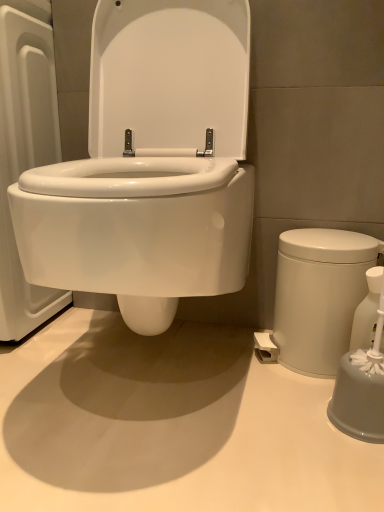
Question: Does white glossy soap dispenser at right have a greater height compared to white glossy trash can at right?

Choices:
 (A) no
 (B) yes

Answer: (A)

Question: Can you confirm if white glossy soap dispenser at right is wider than white glossy trash can at right?

Choices:
 (A) yes
 (B) no

Answer: (B)

Question: Is white glossy soap dispenser at right bigger than white glossy trash can at right?

Choices:
 (A) yes
 (B) no

Answer: (B)

Question: Can you confirm if white glossy soap dispenser at right is shorter than white glossy trash can at right?

Choices:
 (A) yes
 (B) no

Answer: (A)

Question: Considering the relative positions of white glossy soap dispenser at right and white glossy trash can at right in the image provided, is white glossy soap dispenser at right to the left of white glossy trash can at right from the viewer's perspective?

Choices:
 (A) no
 (B) yes

Answer: (A)

Question: Is white glossy trash can at right a part of white glossy soap dispenser at right?

Choices:
 (A) no
 (B) yes

Answer: (A)

Question: Is the position of white glossy trash can at right less distant than that of white glossy soap dispenser at right?

Choices:
 (A) no
 (B) yes

Answer: (A)

Question: Does white glossy trash can at right have a larger size compared to white glossy soap dispenser at right?

Choices:
 (A) no
 (B) yes

Answer: (B)

Question: From the image's perspective, is white glossy trash can at right below white glossy soap dispenser at right?

Choices:
 (A) no
 (B) yes

Answer: (A)

Question: Would you consider white glossy trash can at right to be distant from white glossy soap dispenser at right?

Choices:
 (A) no
 (B) yes

Answer: (A)

Question: Can you confirm if white glossy trash can at right is thinner than white glossy soap dispenser at right?

Choices:
 (A) no
 (B) yes

Answer: (A)

Question: Are white glossy trash can at right and white glossy soap dispenser at right making contact?

Choices:
 (A) yes
 (B) no

Answer: (A)

Question: Is white glossy soap dispenser at right bigger or smaller than white glossy trash can at right?

Choices:
 (A) small
 (B) big

Answer: (A)